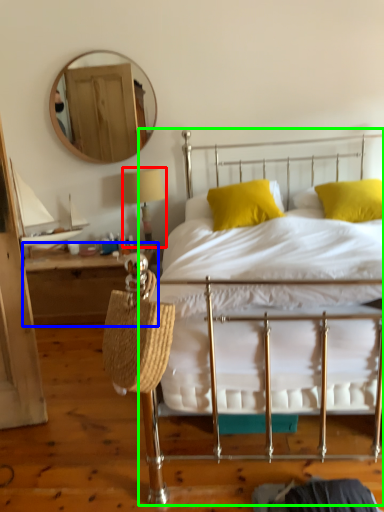
Question: Estimate the real-world distances between objects in this image. Which object is closer to table lamp (highlighted by a red box), nightstand (highlighted by a blue box) or bed (highlighted by a green box)?

Choices:
 (A) nightstand
 (B) bed

Answer: (A)